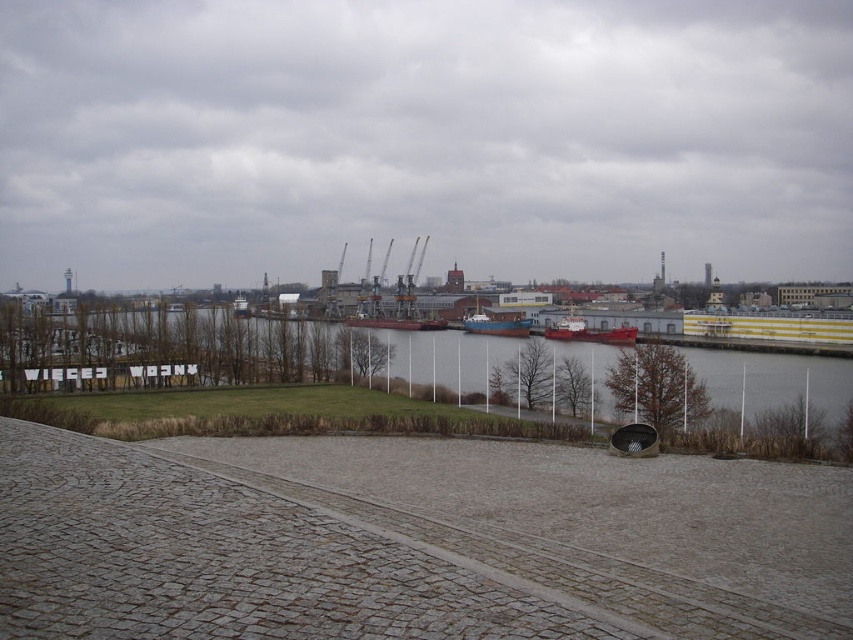
Question: Can you confirm if red matte ship at center is positioned below blue matte boat at center?

Choices:
 (A) no
 (B) yes

Answer: (B)

Question: Does gray concrete river at center have a greater width compared to blue matte boat at center?

Choices:
 (A) no
 (B) yes

Answer: (B)

Question: Which of the following is the farthest from the observer?

Choices:
 (A) (561, 321)
 (B) (469, 326)

Answer: (B)

Question: Is gray concrete river at center to the left of red matte ship at center from the viewer's perspective?

Choices:
 (A) no
 (B) yes

Answer: (B)

Question: Estimate the real-world distances between objects in this image. Which object is farther from the gray concrete river at center?

Choices:
 (A) red matte ship at center
 (B) blue matte boat at center

Answer: (B)

Question: Based on their relative distances, which object is nearer to the gray concrete river at center?

Choices:
 (A) blue matte boat at center
 (B) red matte ship at center

Answer: (B)